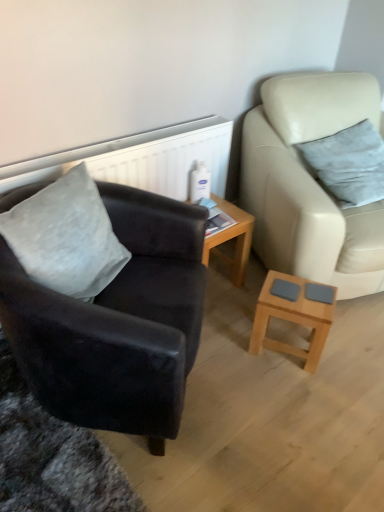
Identify the location of vacant point above light brown wooden coffee table at lower right (from a real-world perspective). (306, 291).